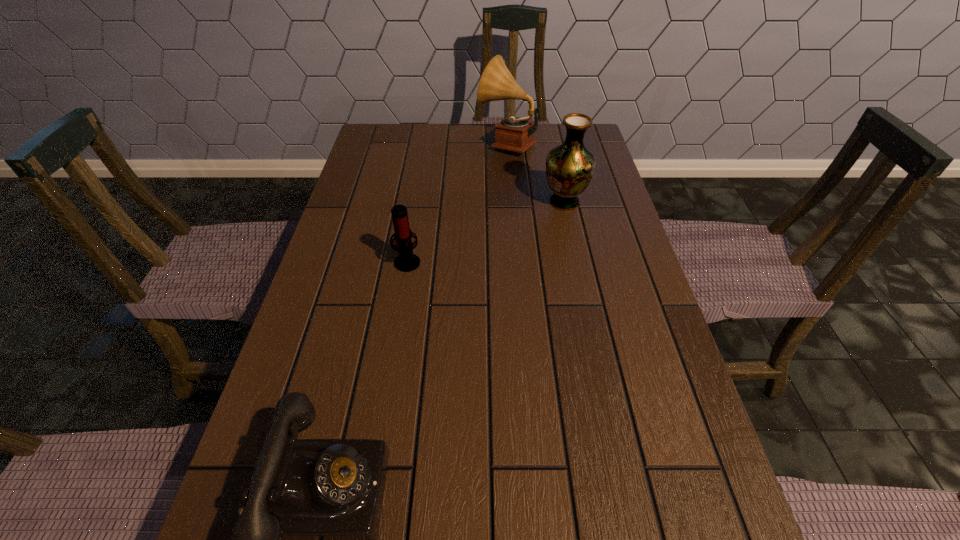
Where is `free space that satisfies the following two spatial constraints: 1. on the horn of the phonograph record; 2. on the front side of the microphone`? The image size is (960, 540). free space that satisfies the following two spatial constraints: 1. on the horn of the phonograph record; 2. on the front side of the microphone is located at coordinates (516, 261).